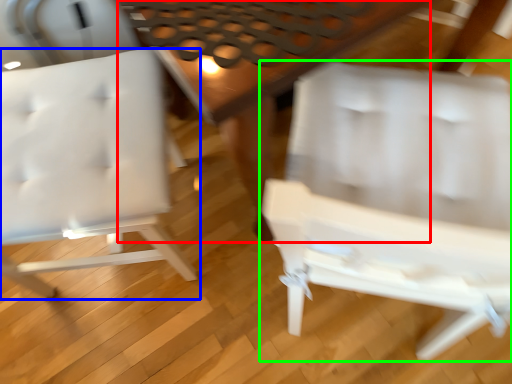
Question: Estimate the real-world distances between objects in this image. Which object is closer to table (highlighted by a red box), chair (highlighted by a blue box) or chair (highlighted by a green box)?

Choices:
 (A) chair
 (B) chair

Answer: (B)